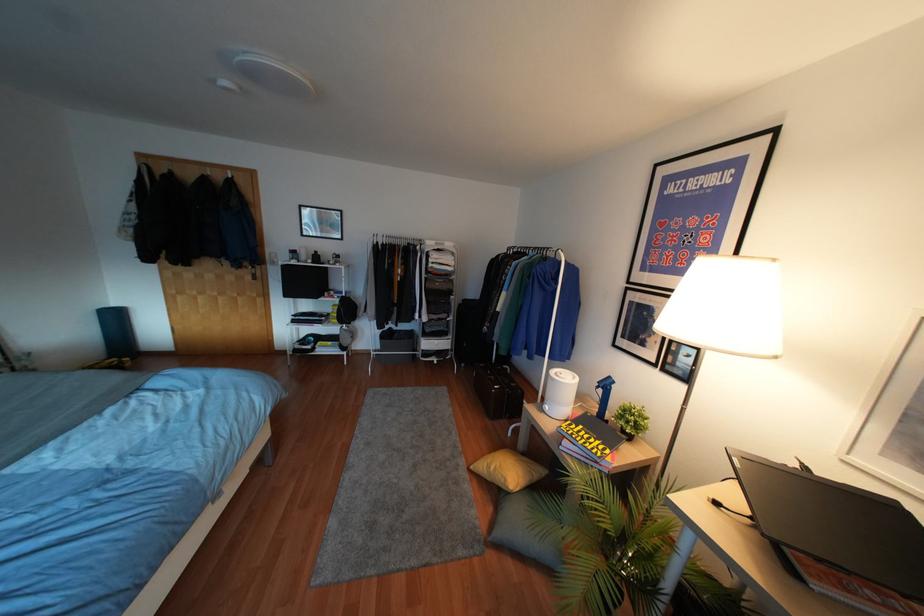
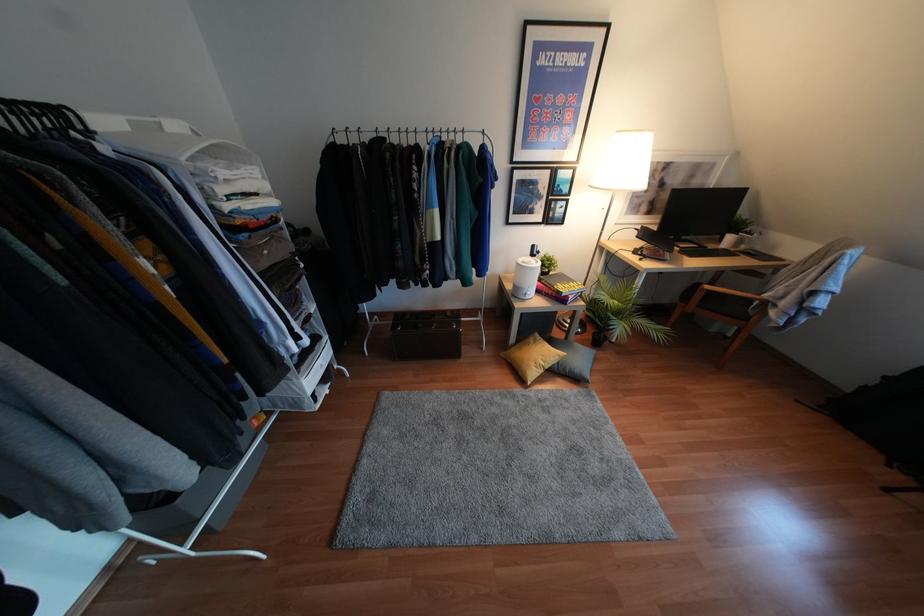
The point at (492, 468) is marked in the first image. Where is the corresponding point in the second image?

(541, 363)